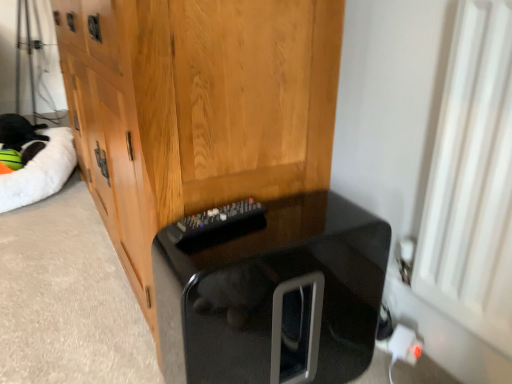
Question: From their relative heights in the image, would you say white plastic plug at lower right is taller or shorter than wooden cabinet at center?

Choices:
 (A) short
 (B) tall

Answer: (A)

Question: Based on their sizes in the image, would you say white plastic plug at lower right is bigger or smaller than wooden cabinet at center?

Choices:
 (A) small
 (B) big

Answer: (A)

Question: Estimate the real-world distances between objects in this image. Which object is farther from the white fluffy cat bed at left?

Choices:
 (A) white plastic plug at lower right
 (B) black glossy cat litter box at lower center
 (C) wooden cabinet at center

Answer: (A)

Question: Which object is positioned closest to the wooden cabinet at center?

Choices:
 (A) white fluffy cat bed at left
 (B) white plastic plug at lower right
 (C) black glossy cat litter box at lower center

Answer: (C)